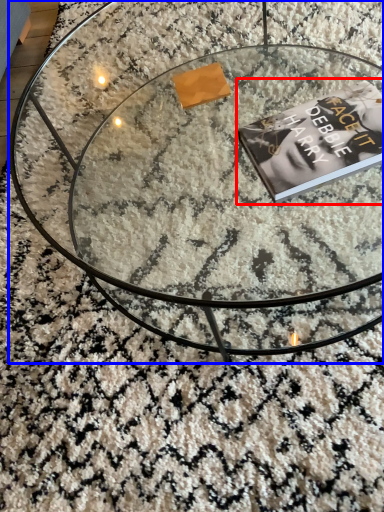
Question: Which object appears farthest to the camera in this image, paperback book (highlighted by a red box) or coffee table (highlighted by a blue box)?

Choices:
 (A) paperback book
 (B) coffee table

Answer: (A)